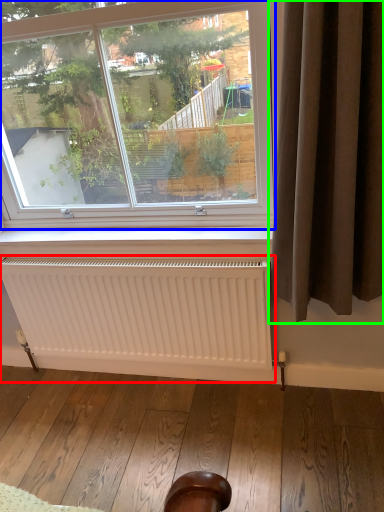
Question: Considering the real-world distances, which object is closest to radiator (highlighted by a red box)? window (highlighted by a blue box) or curtain (highlighted by a green box).

Choices:
 (A) window
 (B) curtain

Answer: (A)